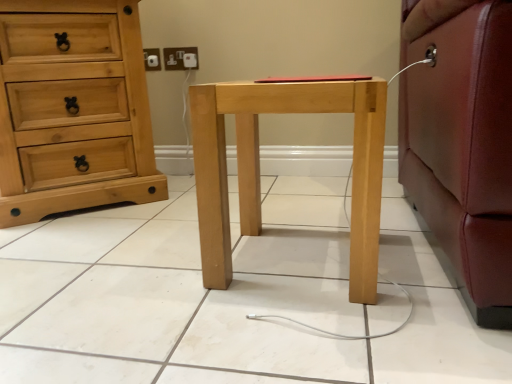
Find the location of a particular element. The width and height of the screenshot is (512, 384). vacant space in natural wood nightstand at center (from a real-world perspective) is located at coordinates (290, 259).